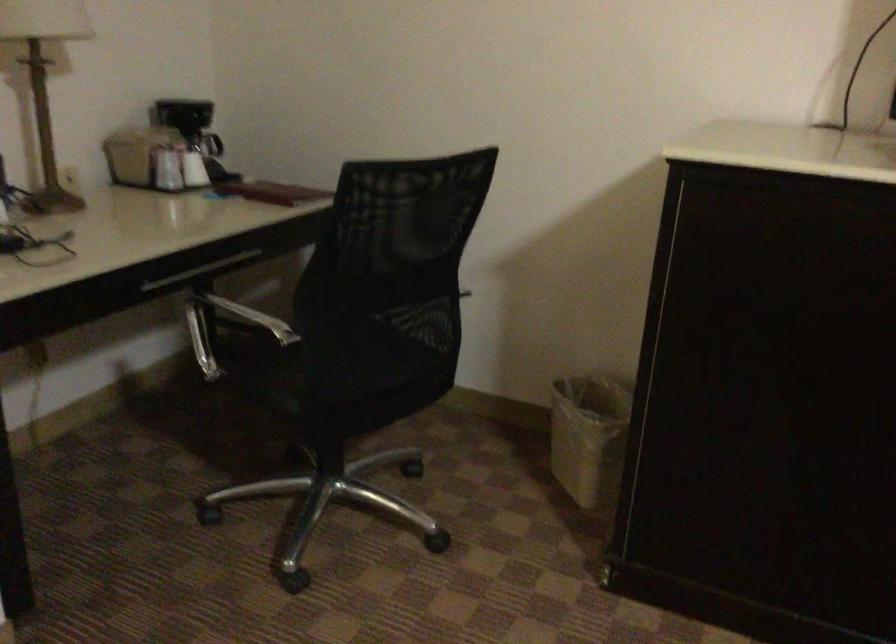
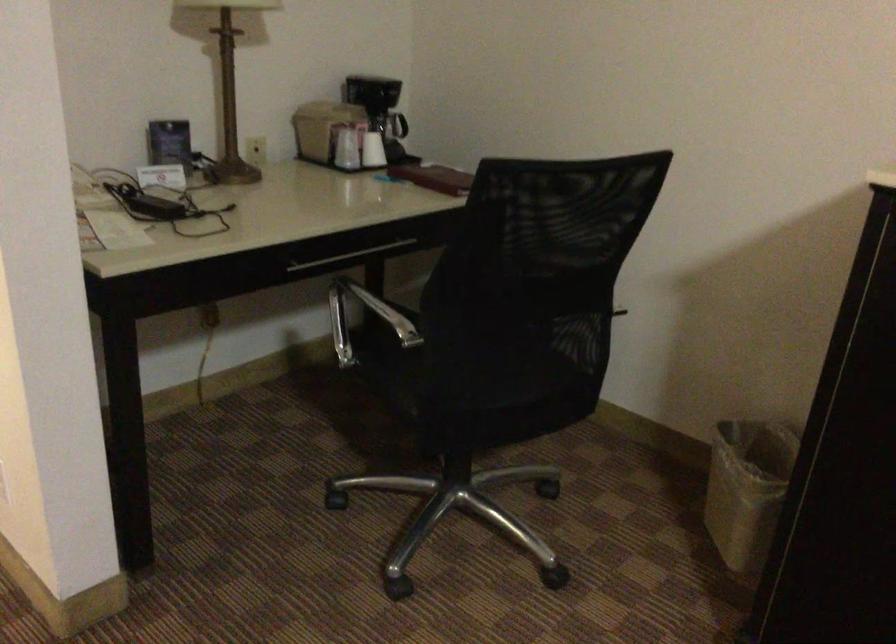
Question: The camera is either moving clockwise (left) or counter-clockwise (right) around the object. The first image is from the beginning of the video and the second image is from the end. Is the camera moving left or right when shooting the video?

Choices:
 (A) Left
 (B) Right

Answer: (B)